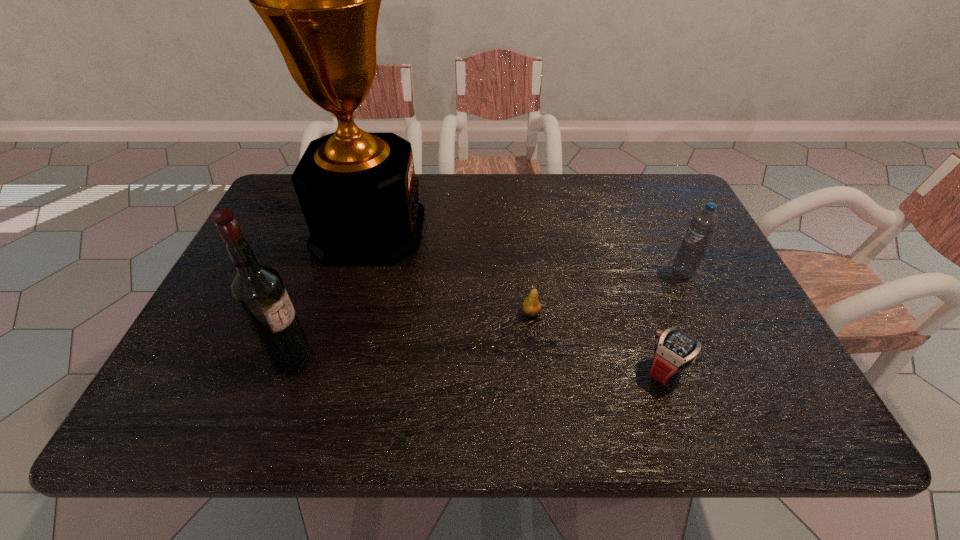
Locate an element on the screen. vacant point located 0.310m on the right of the pear is located at coordinates (676, 313).

Image resolution: width=960 pixels, height=540 pixels. I want to click on free space located on the back of the fourth object from left to right, so click(x=632, y=271).

Locate an element on the screen. object that is at the far edge is located at coordinates (320, 0).

At what (x,y) coordinates should I click in order to perform the action: click on object located in the near edge section of the desktop. Please return your answer as a coordinate pair (x, y). Image resolution: width=960 pixels, height=540 pixels. Looking at the image, I should click on (675, 350).

The image size is (960, 540). What are the coordinates of `object that is at the right edge` in the screenshot? It's located at (703, 224).

Identify the location of vacant space at the far edge of the desktop. (560, 211).

The height and width of the screenshot is (540, 960). Find the location of `free space at the near edge of the desktop`. free space at the near edge of the desktop is located at coordinates (248, 410).

Where is `free space at the left edge of the desktop`? This screenshot has height=540, width=960. free space at the left edge of the desktop is located at coordinates (265, 240).

In the image, there is a desktop. At what (x,y) coordinates should I click in order to perform the action: click on blank space at the right edge. Please return your answer as a coordinate pair (x, y). Looking at the image, I should click on (748, 309).

In the image, there is a desktop. In order to click on free space at the far left corner in this screenshot , I will do 270,206.